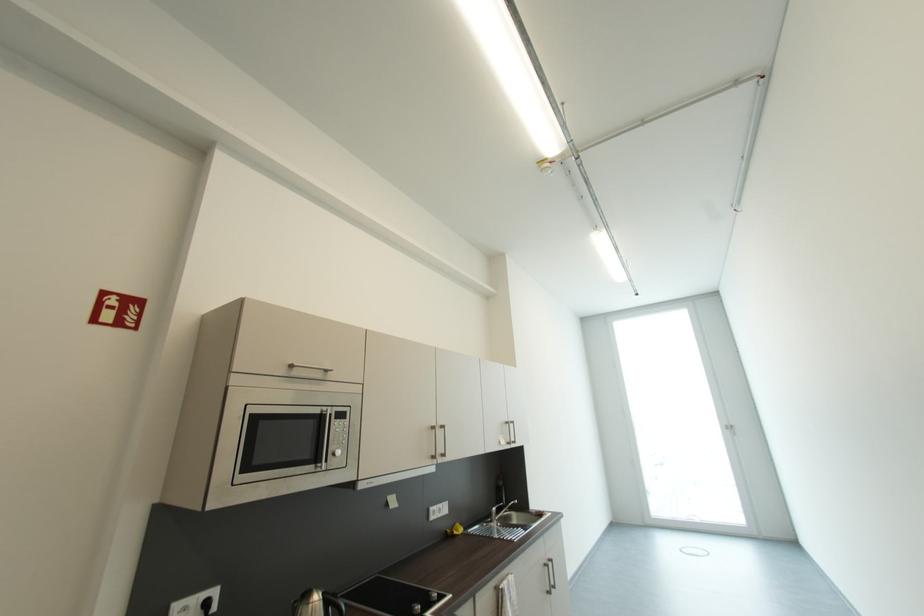
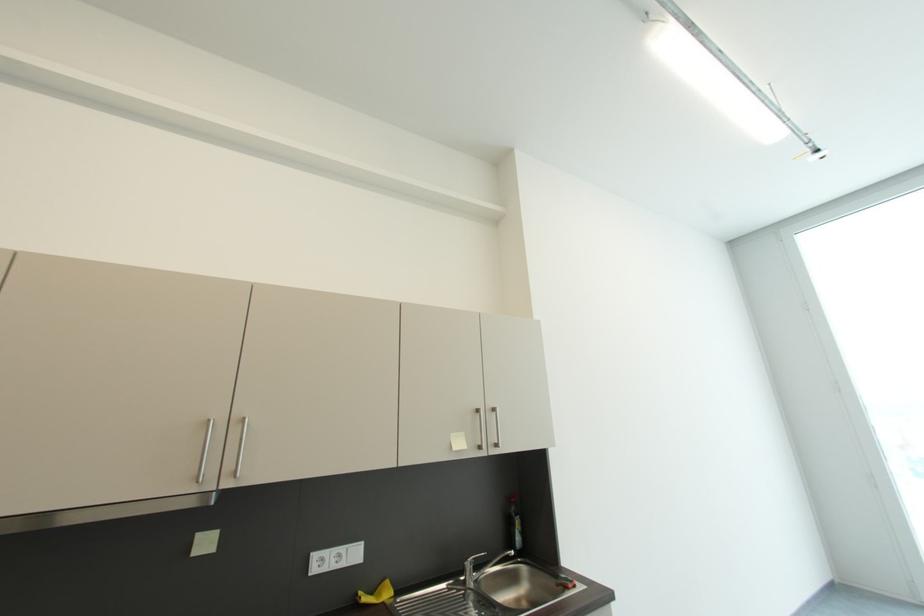
In a continuous first-person perspective shot, in which direction is the camera moving?

The cameraman moved toward right, forward.